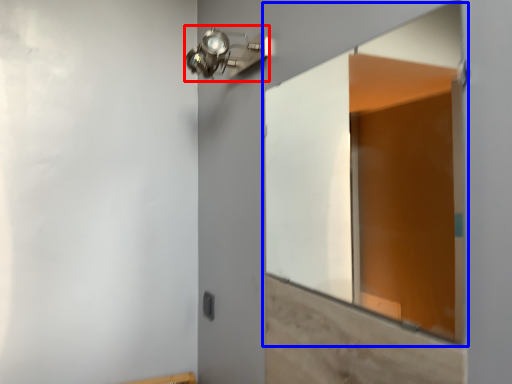
Question: Among these objects, which one is farthest to the camera, light fixture (highlighted by a red box) or window (highlighted by a blue box)?

Choices:
 (A) light fixture
 (B) window

Answer: (A)